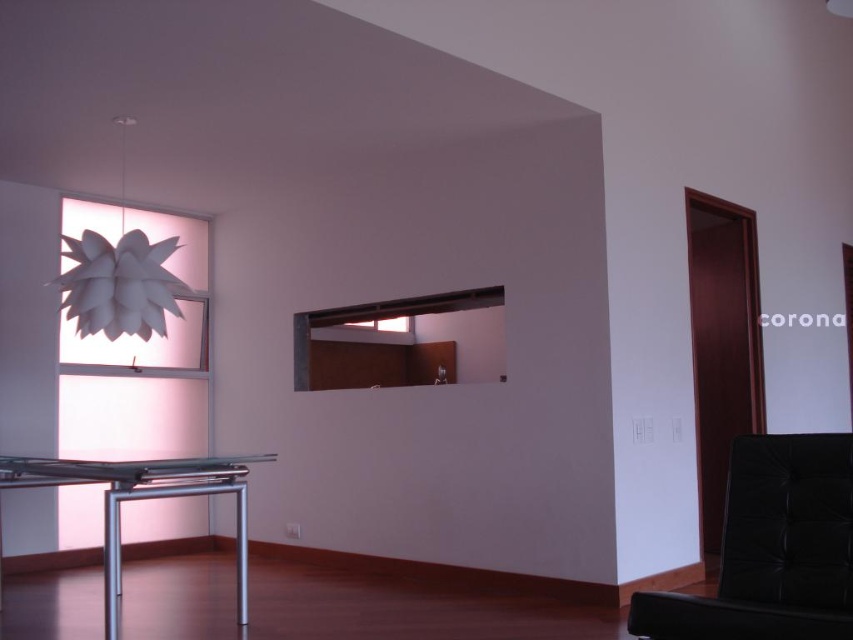
Which is below, silver metallic table at lower left or white paper lamp at upper left?

silver metallic table at lower left is lower down.

Who is more distant from viewer, (115,472) or (131,300)?

Positioned behind is point (131,300).

Does point (103, 556) come closer to viewer compared to point (94, 323)?

Yes, point (103, 556) is in front of point (94, 323).

Identify the location of silver metallic table at lower left. coord(142,499).

Between black leather armchair at lower right and silver metallic table at lower left, which one has less height?

With less height is black leather armchair at lower right.

What are the coordinates of `black leather armchair at lower right` in the screenshot? It's located at (772, 548).

Which is behind, point (820, 595) or point (106, 320)?

Point (106, 320)

In order to click on black leather armchair at lower right in this screenshot , I will do `click(772, 548)`.

Where is `black leather armchair at lower right`? black leather armchair at lower right is located at coordinates (772, 548).